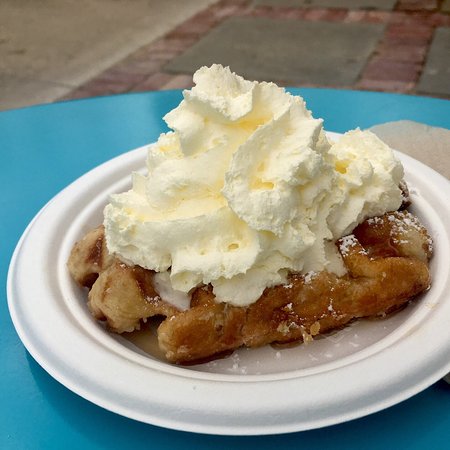
The image size is (450, 450). Identify the location of plate. (322, 402).